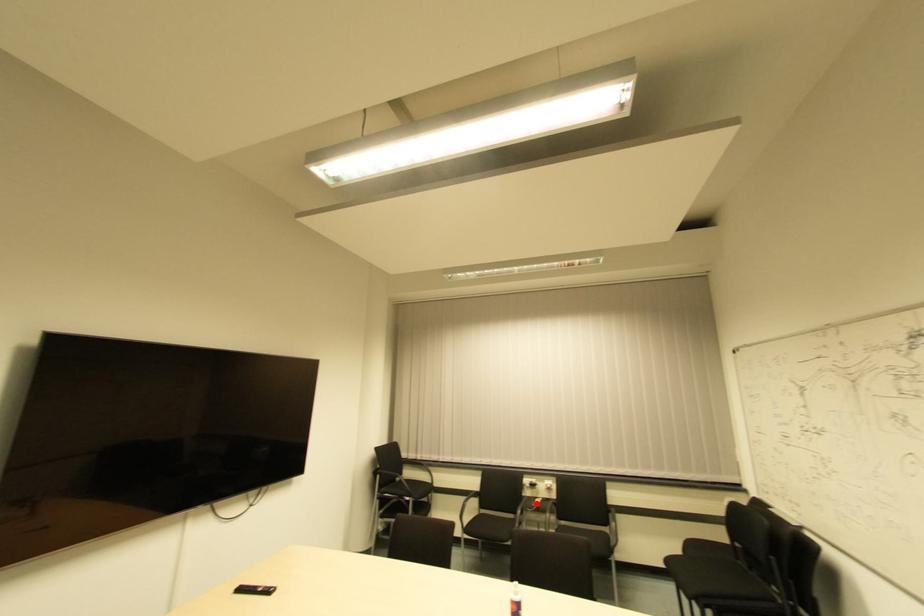
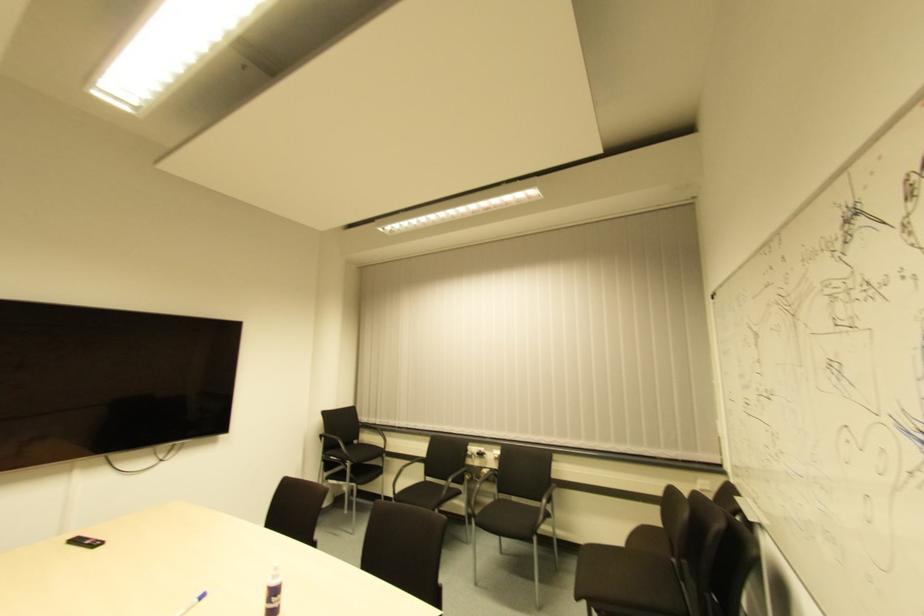
In the second image, find the point that corresponds to the highlighted location in the first image.

(483, 474)